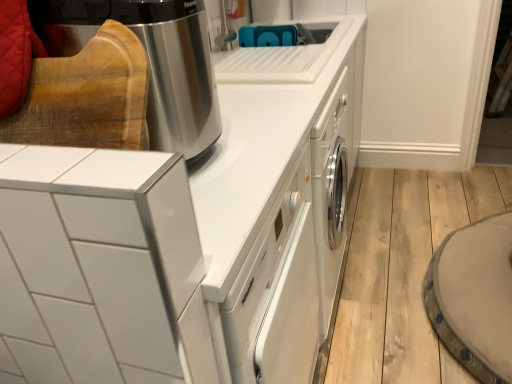
Locate an element on the screen. The height and width of the screenshot is (384, 512). vacant space situated above white glossy dishwasher at center, which is counted as the third home appliance, starting from the top (from a real-world perspective) is located at coordinates (237, 158).